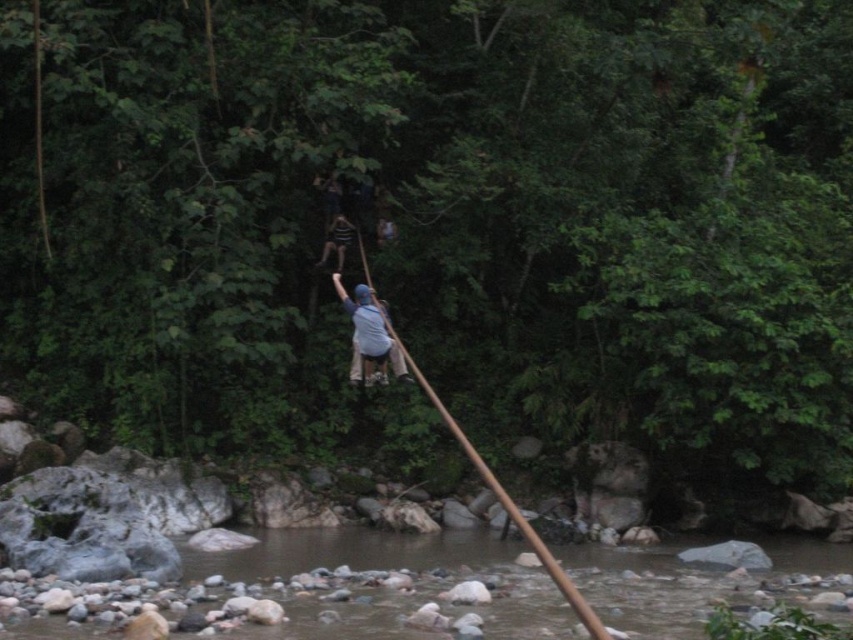
You are standing at the bottom of the wooden pole and looking up towards the top. There are two points marked on the pole at coordinates point (370,301) and point (332,228). Which point is closer to the top of the pole?

Point (332,228) is closer to the top of the pole because it is behind point (370,301).

You are standing at the bottom of the wooden pole and want to reach the top. There is a striped fabric shirt at center and brown rocky water at lower center in your path. Which object will you encounter first as you climb the pole?

The brown rocky water at lower center is in front of the striped fabric shirt at center, so you will encounter the brown rocky water at lower center first while climbing the pole.

You are standing at the edge of the river and see the brown rocky water at lower center and the light blue fabric at center. Which object is closer to you?

The brown rocky water at lower center is closer to you because it is in front of the light blue fabric at center.